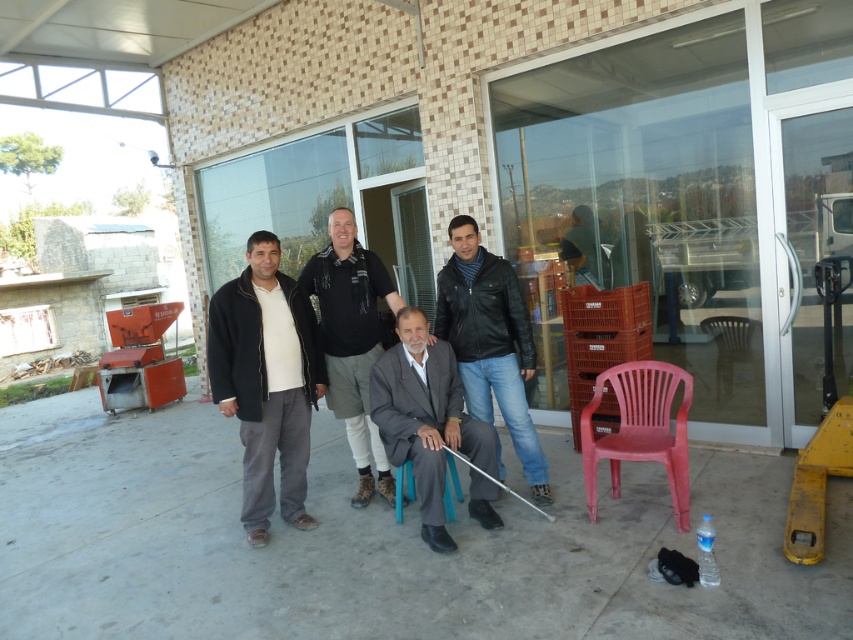
Is leather jacket at center shorter than red plastic chair at right?

In fact, leather jacket at center may be taller than red plastic chair at right.

Who is more distant from viewer, (496, 397) or (672, 502)?

The point (496, 397) is behind.

Does point (474, 346) come farther from viewer compared to point (668, 481)?

Yes, it is behind point (668, 481).

Where is `leather jacket at center`? leather jacket at center is located at coordinates (490, 340).

Can you confirm if dark gray cotton pants at left is positioned above black leather jacket at center?

Incorrect, dark gray cotton pants at left is not positioned above black leather jacket at center.

Between point (281, 413) and point (349, 296), which one is positioned in front?

Positioned in front is point (281, 413).

Locate an element on the screen. The image size is (853, 640). dark gray cotton pants at left is located at coordinates (265, 381).

Can you confirm if dark gray cotton pants at left is positioned to the right of red plastic chair at right?

No, dark gray cotton pants at left is not to the right of red plastic chair at right.

Locate an element on the screen. dark gray cotton pants at left is located at coordinates (265, 381).

Is point (235, 365) in front of point (602, 372)?

That is True.

Where is `dark gray cotton pants at left`? The image size is (853, 640). dark gray cotton pants at left is located at coordinates (265, 381).